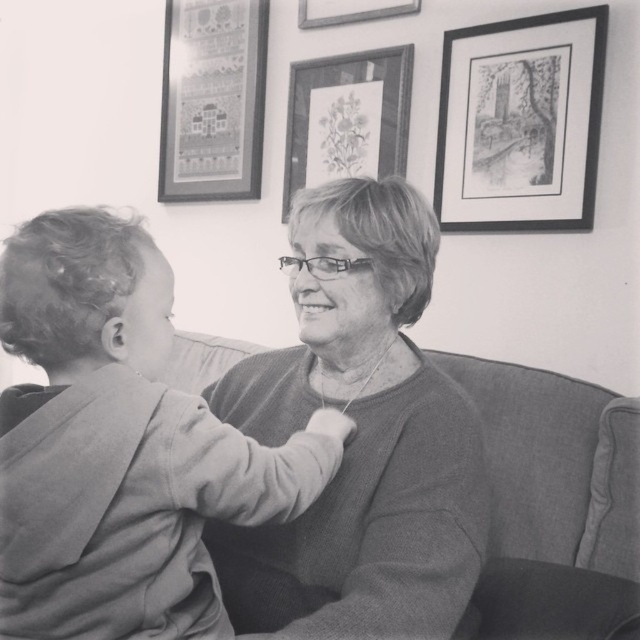
Based on the photo, in the scene, there are two picture frames on the wall. The black paper picture frame at upper right and the matte paper picture frame at upper center. Which one is bigger?

The black paper picture frame at upper right is larger than the matte paper picture frame at upper center.

You are an interior designer planning to hang a new artwork in the living room. You see the knitted sweater at center and the black paper picture frame at upper right. Which object is bigger in size?

The knitted sweater at center is larger in size compared to the black paper picture frame at upper right.